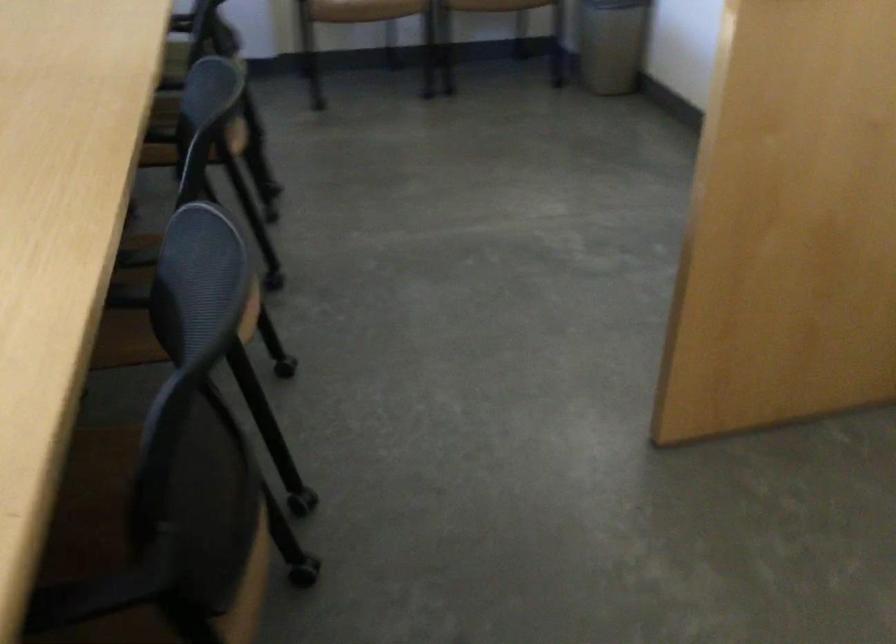
The width and height of the screenshot is (896, 644). What do you see at coordinates (612, 44) in the screenshot?
I see `a metal trash can` at bounding box center [612, 44].